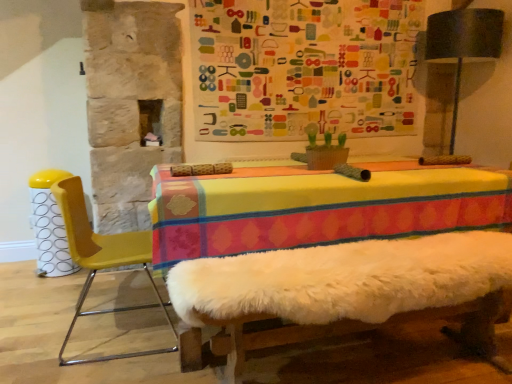
Question: In which direction should I rotate to look at multicolored fabric bulletin board at upper center?

Choices:
 (A) right
 (B) left

Answer: (A)

Question: Can you confirm if yellow plastic bar stool at left is positioned to the right of white fluffy bed frame at center?

Choices:
 (A) yes
 (B) no

Answer: (B)

Question: Is yellow plastic bar stool at left outside white fluffy bed frame at center?

Choices:
 (A) no
 (B) yes

Answer: (B)

Question: Considering the relative sizes of yellow plastic bar stool at left and white fluffy bed frame at center in the image provided, is yellow plastic bar stool at left smaller than white fluffy bed frame at center?

Choices:
 (A) no
 (B) yes

Answer: (B)

Question: From a real-world perspective, is yellow plastic bar stool at left located higher than white fluffy bed frame at center?

Choices:
 (A) no
 (B) yes

Answer: (B)

Question: Does yellow plastic bar stool at left have a lesser height compared to white fluffy bed frame at center?

Choices:
 (A) yes
 (B) no

Answer: (B)

Question: Are yellow plastic bar stool at left and white fluffy bed frame at center making contact?

Choices:
 (A) yes
 (B) no

Answer: (B)

Question: Is white fluffy bed frame at center positioned with its back to yellow plastic bar stool at left?

Choices:
 (A) yes
 (B) no

Answer: (B)

Question: Does white fluffy bed frame at center touch yellow plastic bar stool at left?

Choices:
 (A) no
 (B) yes

Answer: (A)

Question: From a real-world perspective, does white fluffy bed frame at center sit lower than yellow plastic bar stool at left?

Choices:
 (A) yes
 (B) no

Answer: (A)

Question: Is white fluffy bed frame at center to the left of yellow plastic bar stool at left from the viewer's perspective?

Choices:
 (A) no
 (B) yes

Answer: (A)

Question: From a real-world perspective, is white fluffy bed frame at center positioned over yellow plastic bar stool at left based on gravity?

Choices:
 (A) yes
 (B) no

Answer: (B)

Question: Is white fluffy bed frame at center shorter than yellow plastic bar stool at left?

Choices:
 (A) yes
 (B) no

Answer: (A)

Question: From the image's perspective, is yellow plastic chair at left on top of yellow plastic bar stool at left?

Choices:
 (A) yes
 (B) no

Answer: (B)